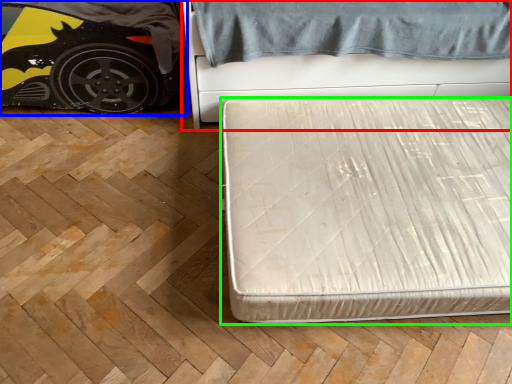
Question: Which is farther away from bed (highlighted by a red box)? car (highlighted by a blue box) or bed (highlighted by a green box)?

Choices:
 (A) car
 (B) bed

Answer: (A)